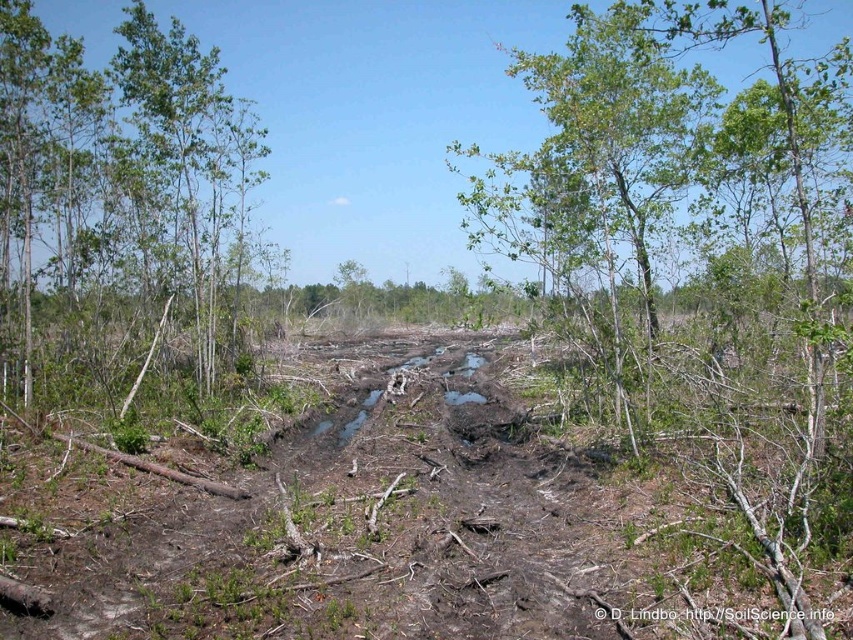
Looking at this image, you are standing at the point marked by the coordinates point (694, 253) in the image. Looking around, you see the green leafy tree at center. What is the direction of the green leafy tree at center relative to your position?

The green leafy tree at center is located directly in front of you since you are standing at its coordinates point (694, 253).

You are standing at the point with coordinates point [15,68] and want to walk to the point with coordinates point [773,404]. Which direction should you move in to reach your destination?

You should move forward because point [773,404] is in front of point [15,68].